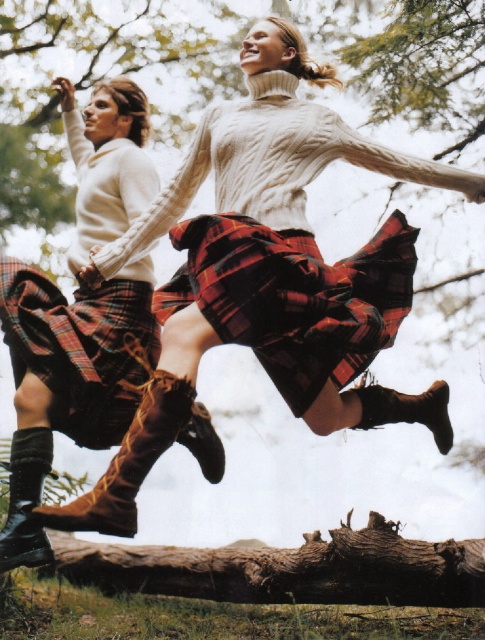
You are an observer watching two people jump over a fallen tree trunk. You notice two skirts in the scene. Which skirt is closer to the ground? The plaid skirt at center or the plaid fabric skirt at center?

The plaid skirt at center is positioned under the plaid fabric skirt at center, so the plaid skirt at center is closer to the ground.

In the scene shown: You are a photographer trying to capture a closeup shot of the plaid wool kilt at lower left and the black leather boot at lower left. Given that your camera has a maximum focus range of 10 inches, can you fit both items within the focus range?

The plaid wool kilt at lower left is 9.77 inches away from the black leather boot at lower left. Since the distance between them is less than the camera maximum focus range of 10 inches, you can fit both items within the focus range.

You are standing at the point marked by the coordinates point (128, 461). Looking around, you see two people jumping over a fallen tree trunk. Which direction should you move to reach the brown suede boot at lower left?

The point 0.723, 0624 is already on the brown suede boot at lower left, so you are already at the location of the brown suede boot at lower left.